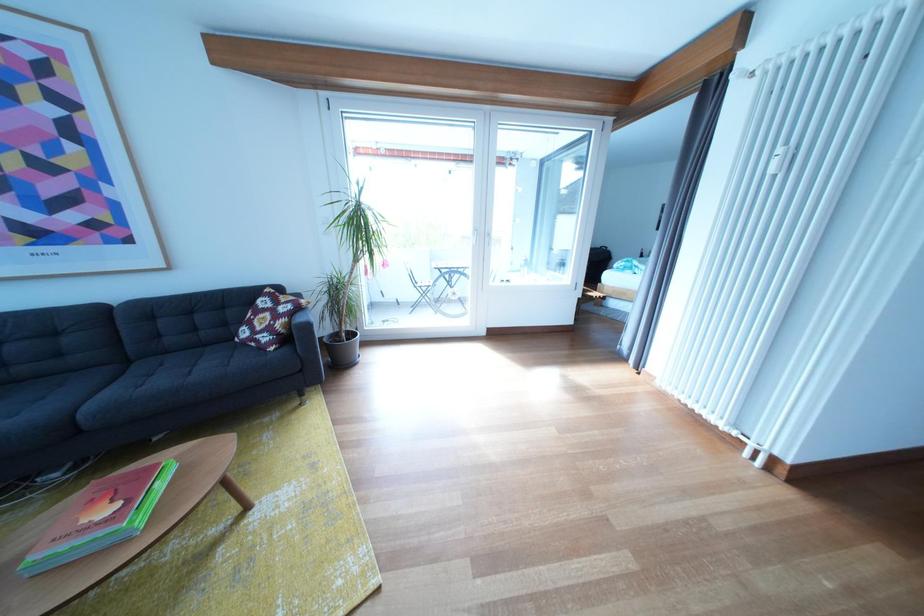
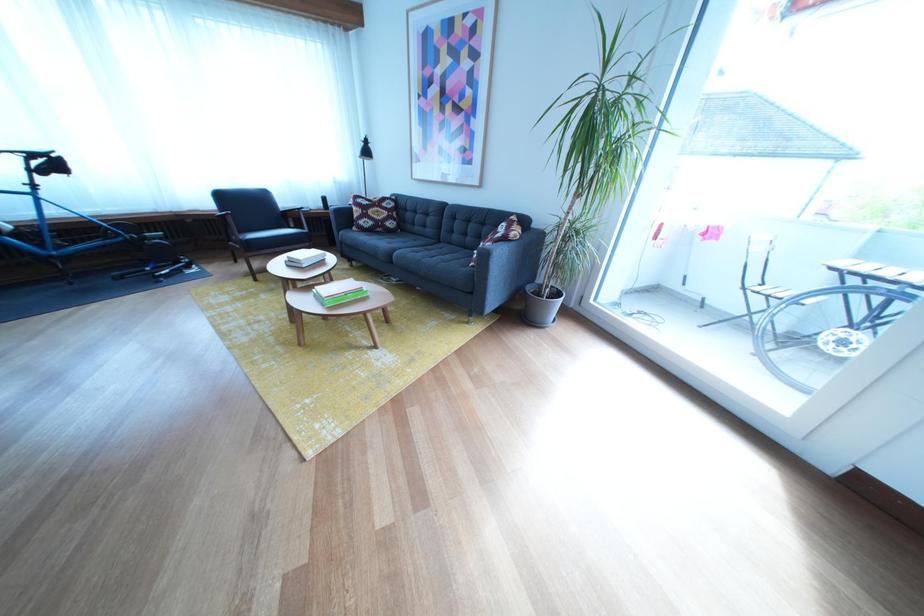
Where in the second image is the point corresponding to point (141, 368) from the first image?

(453, 248)